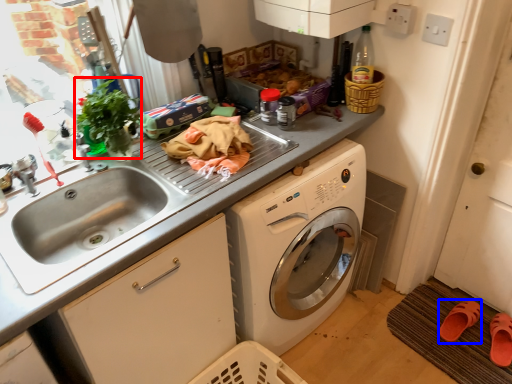
Question: Which point is closer to the camera, plant (highlighted by a red box) or shoe (highlighted by a blue box)?

Choices:
 (A) plant
 (B) shoe

Answer: (A)